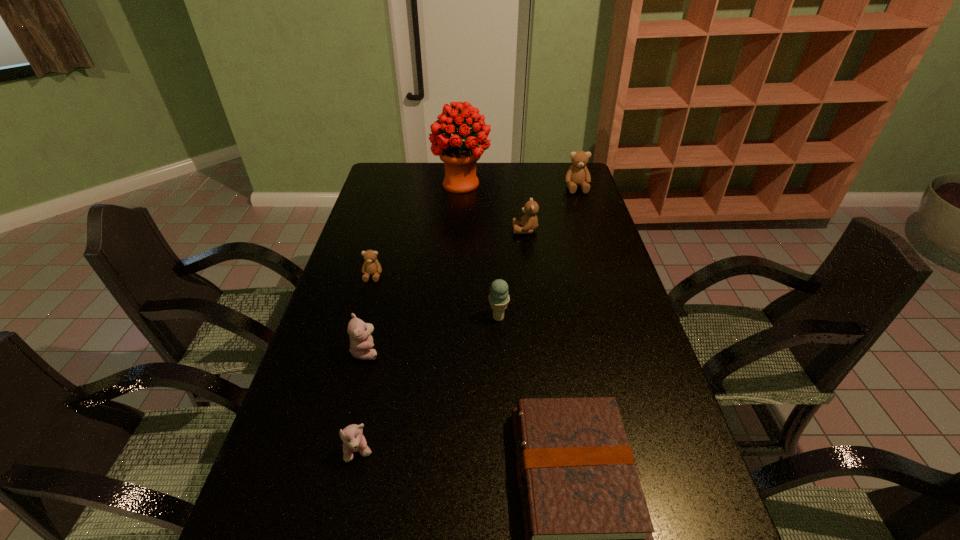
You are a GUI agent. You are given a task and a screenshot of the screen. Output one action in this format:
    pyautogui.click(x=<x>, y=<y>)
    Task: Click on the leftmost brown teddy bear
    The height and width of the screenshot is (540, 960).
    Given the screenshot: What is the action you would take?
    [371, 266]

Find the location of a particular element. The image size is (960, 540). the smaller pink teddy bear is located at coordinates (352, 436).

Identify the location of the nearer pink teddy bear. The image size is (960, 540). (352, 436).

Find the location of a particular element. This screenshot has width=960, height=540. free spot located on the right of the bouquet is located at coordinates (579, 184).

Where is `vacant space situated on the front-facing side of the rightmost brown teddy bear`? vacant space situated on the front-facing side of the rightmost brown teddy bear is located at coordinates (588, 219).

You are a GUI agent. You are given a task and a screenshot of the screen. Output one action in this format:
    pyautogui.click(x=<x>, y=<y>)
    Task: Click on the free space located 0.110m on the front of the blue ice cream
    Image resolution: width=960 pixels, height=540 pixels.
    Given the screenshot: What is the action you would take?
    pyautogui.click(x=500, y=356)

In order to click on free spot located 0.300m on the front-facing side of the second brown teddy bear from right to left in this screenshot , I will do `click(429, 230)`.

The image size is (960, 540). I want to click on free location located on the front-facing side of the second brown teddy bear from right to left, so click(471, 230).

At what (x,y) coordinates should I click in order to perform the action: click on vacant space situated on the front-facing side of the second brown teddy bear from right to left. Please return your answer as a coordinate pair (x, y). Looking at the image, I should click on (449, 230).

The width and height of the screenshot is (960, 540). I want to click on free space located 0.070m at the face of the bigger pink teddy bear, so click(x=406, y=351).